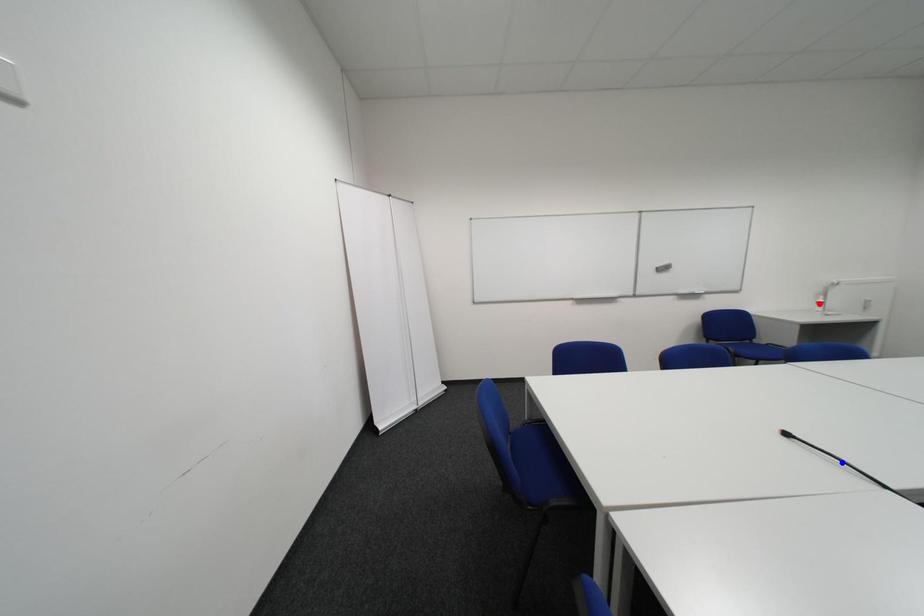
Question: In the image, two points are highlighted. Which point is nearer to the camera? Reply with the corresponding letter.

Choices:
 (A) blue point
 (B) red point

Answer: (A)